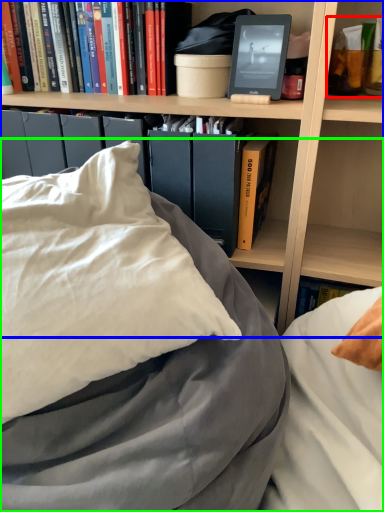
Question: Considering the real-world distances, which object is closest to book (highlighted by a red box)? bookcase (highlighted by a blue box) or bed (highlighted by a green box).

Choices:
 (A) bookcase
 (B) bed

Answer: (A)